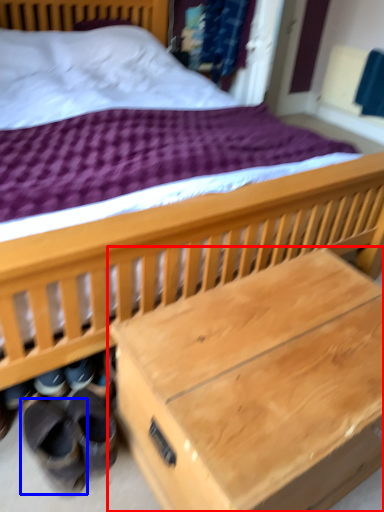
Question: Which object appears closest to the camera in this image, table (highlighted by a red box) or footwear (highlighted by a blue box)?

Choices:
 (A) table
 (B) footwear

Answer: (A)